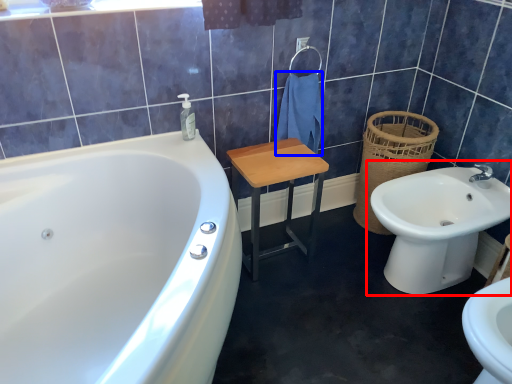
Question: Among these objects, which one is nearest to the camera, sink (highlighted by a red box) or bath towel (highlighted by a blue box)?

Choices:
 (A) sink
 (B) bath towel

Answer: (A)